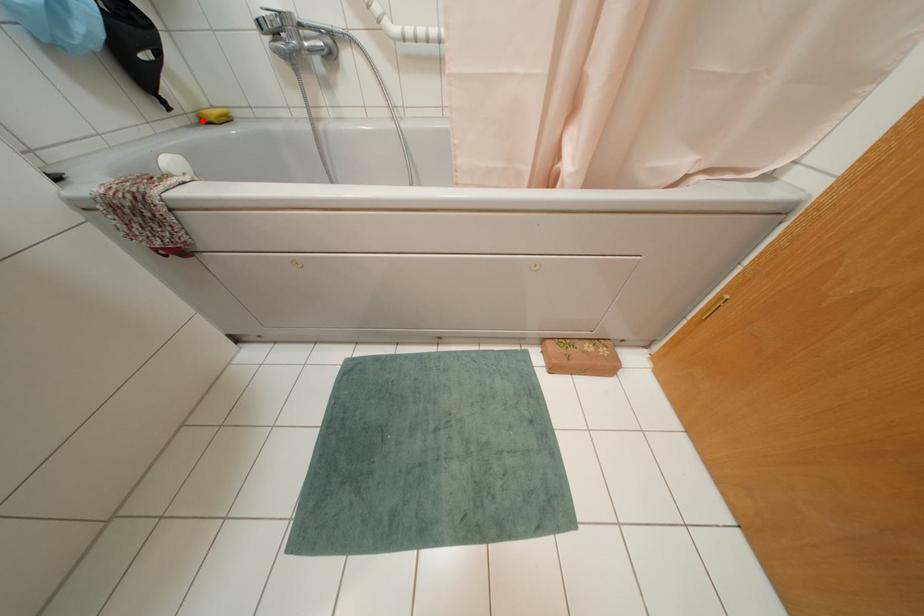
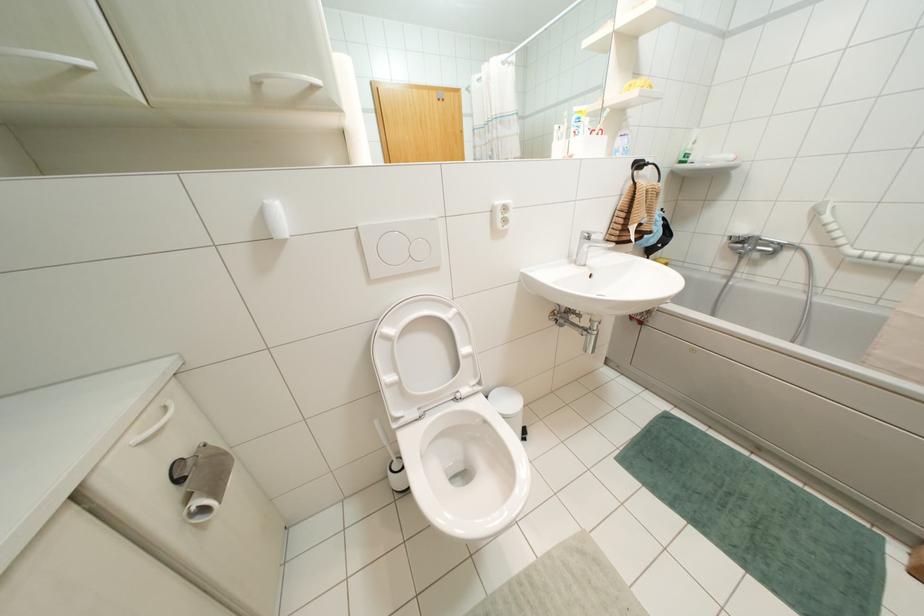
Question: I am providing you with two images of the same scene from different viewpoints. A red point is marked on the first image. Is the red point's position out of view in image 2?

Choices:
 (A) Yes
 (B) No

Answer: (A)